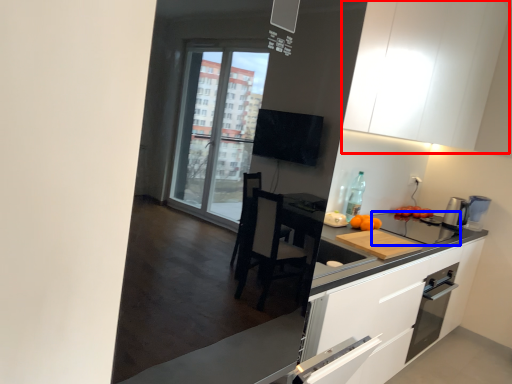
Question: Which point is closer to the camera, cabinetry (highlighted by a red box) or appliance (highlighted by a blue box)?

Choices:
 (A) cabinetry
 (B) appliance

Answer: (A)